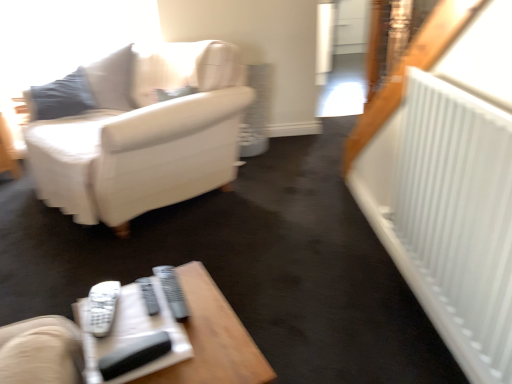
The height and width of the screenshot is (384, 512). What are the coordinates of `vacant space to the right of white plastic remote at lower center, the first remote from the left` in the screenshot? It's located at (196, 306).